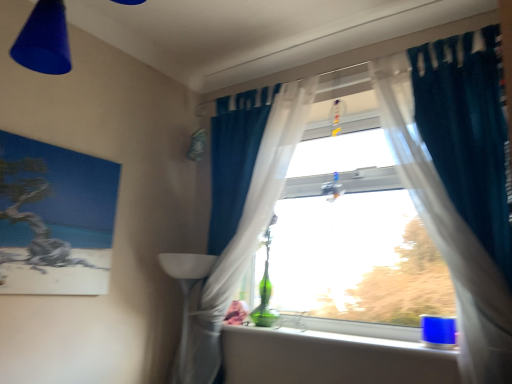
Question: Looking at the image, does blue plastic cup at lower right seem bigger or smaller compared to teal fabric curtain at upper right, marked as the first curtain in a right-to-left arrangement?

Choices:
 (A) big
 (B) small

Answer: (B)

Question: Considering the positions of blue plastic cup at lower right and teal fabric curtain at upper right, marked as the second curtain in a left-to-right arrangement, in the image, is blue plastic cup at lower right taller or shorter than teal fabric curtain at upper right, marked as the second curtain in a left-to-right arrangement,?

Choices:
 (A) tall
 (B) short

Answer: (B)

Question: Considering the real-world distances, which object is farthest from the blue plastic cup at lower right?

Choices:
 (A) matte canvas painting at left
 (B) teal fabric curtain at upper right, marked as the second curtain in a left-to-right arrangement
 (C) matte plastic cone at upper left
 (D) translucent fabric curtain at center, the second curtain from the right

Answer: (C)

Question: Which object is the closest to the teal fabric curtain at upper right, marked as the second curtain in a left-to-right arrangement?

Choices:
 (A) matte canvas painting at left
 (B) blue plastic cup at lower right
 (C) matte plastic cone at upper left
 (D) translucent fabric curtain at center, the 1th curtain in the left-to-right sequence

Answer: (B)